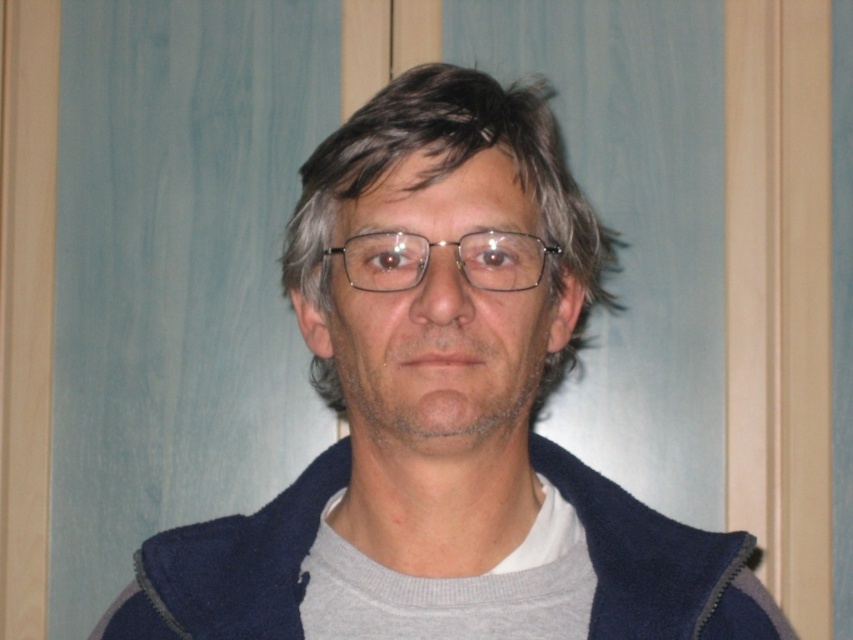
You are a fashion designer observing the image. You need to determine the spatial relationship between the navy fleece jacket at center and the clear plastic glasses at center. Which item is positioned lower in the image?

The navy fleece jacket at center is located below clear plastic glasses at center, so the jacket is positioned lower than the glasses.

You are a fashion designer observing the person in the image. You need to determine if the navy fleece jacket at center can be worn over the clear plastic glasses at center without the glasses being covered. Based on their positions and sizes, what do you think?

The navy fleece jacket at center has a greater height compared to the clear plastic glasses at center, so the jacket is taller than the glasses. This means the glasses would likely be positioned below the jacket when worn, so they would not be covered.

You are a photographer setting up a shoot in this room. You want to ensure that both the navy fleece jacket at center and the clear plastic glasses at center are visible in the final photo. Given their current positions, will the glasses be visible without moving them?

The clear plastic glasses at center is behind navy fleece jacket at center, so they might be obscured. To ensure visibility, adjust the camera angle or move the glasses forward.